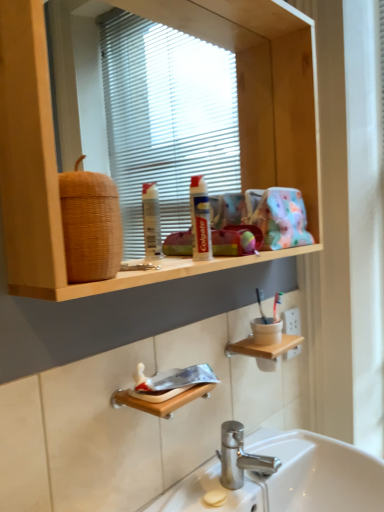
Question: Is wooden shelf at upper center spatially inside wooden shelf at lower center, or outside of it?

Choices:
 (A) inside
 (B) outside

Answer: (B)

Question: Is wooden shelf at upper center taller or shorter than wooden shelf at lower center?

Choices:
 (A) short
 (B) tall

Answer: (B)

Question: Which object is the closest to the white glossy sink at lower center?

Choices:
 (A) woven brown basket at upper left
 (B) wooden shelf at upper center
 (C) wooden shelf at lower center

Answer: (C)

Question: Considering the real-world distances, which object is closest to the woven brown basket at upper left?

Choices:
 (A) wooden shelf at lower center
 (B) wooden shelf at upper center
 (C) white glossy sink at lower center

Answer: (B)